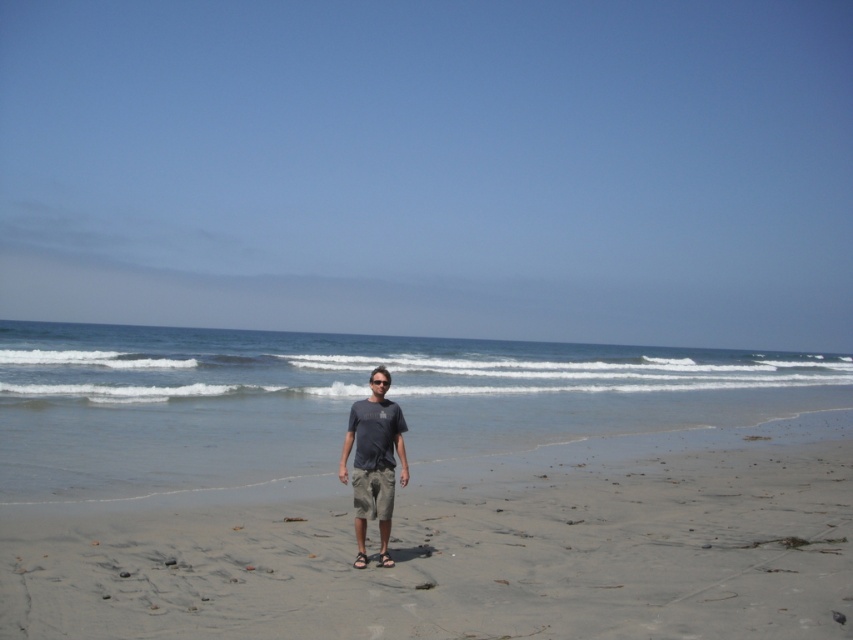
Question: Which of these objects is positioned farthest from the gray sand at center?

Choices:
 (A) black rubber sandal at center
 (B) brown leather sandal at center
 (C) dark gray t-shirt at center

Answer: (B)

Question: Which of the following is the farthest from the observer?

Choices:
 (A) gray sand at center
 (B) brown leather sandal at center
 (C) black rubber sandal at center
 (D) dark gray t-shirt at center

Answer: (C)

Question: Which point appears farthest from the camera in this image?

Choices:
 (A) (390, 513)
 (B) (363, 564)

Answer: (B)

Question: Can you confirm if gray sand at center is thinner than dark gray t-shirt at center?

Choices:
 (A) yes
 (B) no

Answer: (B)

Question: Does gray sand at center appear over dark gray t-shirt at center?

Choices:
 (A) yes
 (B) no

Answer: (B)

Question: Does gray sand at center appear over dark gray t-shirt at center?

Choices:
 (A) yes
 (B) no

Answer: (B)